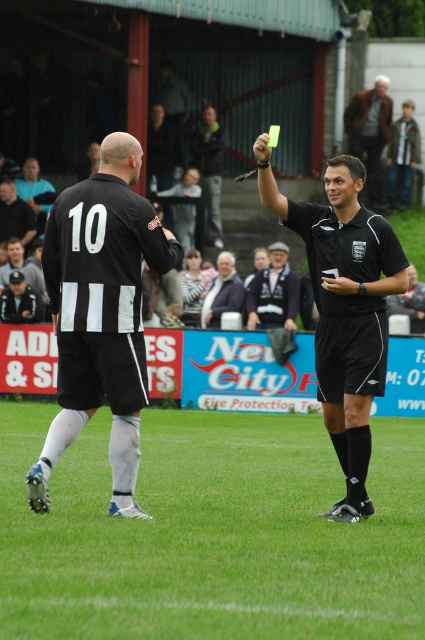
You are a soccer player who just received a yellow card. You need to quickly find the referee to argue your case. Looking at the image, which object is closer to you so you can move towards it first? The green grass at center or the green fabric jacket at upper center?

The green grass at center is closer to you because it is larger in size than the green fabric jacket at upper center, which is further away.